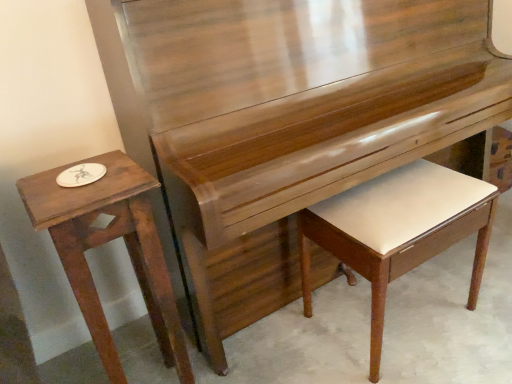
Locate an element on the screen. The width and height of the screenshot is (512, 384). blank area to the left of white leather music stool at lower right is located at coordinates (x=289, y=337).